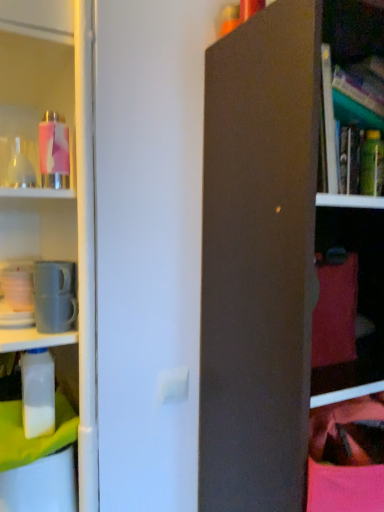
Question: Is translucent glass bottle at upper left, the third bottle positioned from the top, aimed at pink matte water bottle at upper left, the 2th bottle in the right-to-left sequence?

Choices:
 (A) yes
 (B) no

Answer: (B)

Question: Is pink matte water bottle at upper left, marked as the 1th bottle in a top-to-bottom arrangement, located within translucent glass bottle at upper left, the first bottle viewed from the left?

Choices:
 (A) no
 (B) yes

Answer: (A)

Question: Is translucent glass bottle at upper left, the third bottle positioned from the top, turned away from pink matte water bottle at upper left, marked as the 1th bottle in a top-to-bottom arrangement?

Choices:
 (A) no
 (B) yes

Answer: (B)

Question: Can you confirm if translucent glass bottle at upper left, the third bottle positioned from the top, is taller than pink matte water bottle at upper left, which ranks as the fourth bottle in bottom-to-top order?

Choices:
 (A) no
 (B) yes

Answer: (A)

Question: From the image's perspective, is translucent glass bottle at upper left, the fourth bottle in the right-to-left sequence, beneath pink matte water bottle at upper left, which ranks as the fourth bottle in bottom-to-top order?

Choices:
 (A) no
 (B) yes

Answer: (B)

Question: Does point (54, 139) appear closer or farther from the camera than point (23, 352)?

Choices:
 (A) closer
 (B) farther

Answer: (A)

Question: From the image's perspective, is pink matte water bottle at upper left, which ranks as the fourth bottle in bottom-to-top order, above or below white plastic bottle at left, which is the 3th bottle from right to left?

Choices:
 (A) below
 (B) above

Answer: (B)

Question: Choose the correct answer: Is pink matte water bottle at upper left, marked as the 1th bottle in a top-to-bottom arrangement, inside white plastic bottle at left, which is the 3th bottle from right to left, or outside it?

Choices:
 (A) outside
 (B) inside

Answer: (A)

Question: In terms of width, does pink matte water bottle at upper left, marked as the 1th bottle in a top-to-bottom arrangement, look wider or thinner when compared to white plastic bottle at left, which is the 3th bottle from right to left?

Choices:
 (A) wide
 (B) thin

Answer: (B)

Question: Visually, is green matte bottle at upper right, the third bottle from the bottom, positioned to the left or to the right of white plastic bottle at left, the 1th bottle in the bottom-to-top sequence?

Choices:
 (A) right
 (B) left

Answer: (A)

Question: Is green matte bottle at upper right, the second bottle from the top, spatially inside white plastic bottle at left, which is the 3th bottle from right to left, or outside of it?

Choices:
 (A) inside
 (B) outside

Answer: (B)

Question: From the image's perspective, is green matte bottle at upper right, the second bottle from the top, above or below white plastic bottle at left, the 1th bottle in the bottom-to-top sequence?

Choices:
 (A) below
 (B) above

Answer: (B)

Question: Is point (364, 166) closer or farther from the camera than point (34, 352)?

Choices:
 (A) closer
 (B) farther

Answer: (B)

Question: In the image, is white plastic bottle at left, the 1th bottle in the bottom-to-top sequence, on the left side or the right side of pink matte water bottle at upper left, the third bottle in the left-to-right sequence?

Choices:
 (A) left
 (B) right

Answer: (A)

Question: In the image, is white plastic bottle at left, which is the 3th bottle from right to left, positioned in front of or behind pink matte water bottle at upper left, the third bottle in the left-to-right sequence?

Choices:
 (A) front
 (B) behind

Answer: (B)